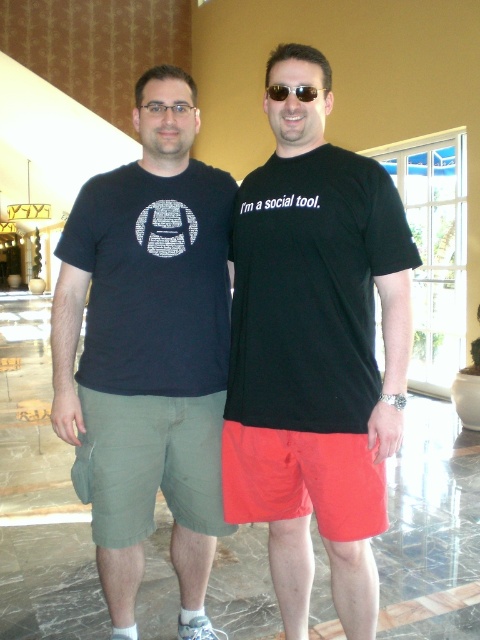
You are taking a photo in the hotel lobby and want to focus on both the point at [285,308] and the point at [301,86]. Which point should you adjust your camera focus to prioritize for better clarity?

Point at [285,308] should be prioritized for focus since it is closer to the camera and will appear clearer in the photo.